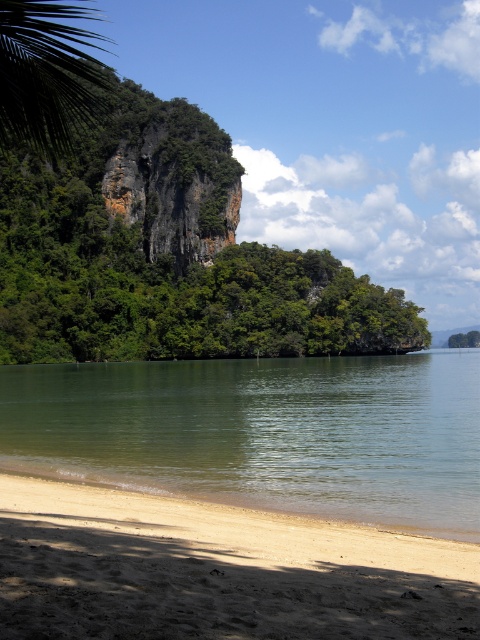
Consider the image. You are standing at the beach looking at the coastal landscape. There are two points marked in the image, one at coordinates point [187,611] and the other at point [86,72]. Which of these two points is nearer to you?

Point [187,611] is closer to the camera than point [86,72], so the point at coordinates point [187,611] is nearer to you.

You are standing on the light brown sandy beach at lower left and want to reach the green smooth water at lower left. Which direction should you move to get there?

Since the green smooth water at lower left has a larger size compared to the light brown sandy beach at lower left, you should move towards the area where the water extends further. However, based on the scene description, the water is already at the lower left edge near the beach, so moving towards the direction of the water from the beach would be appropriate.